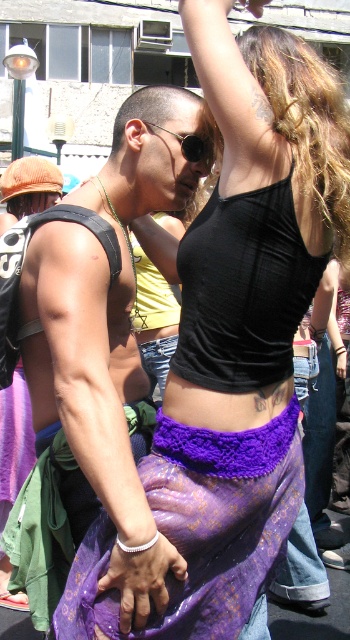
You are a photographer standing at the edge of the crowd. You want to take a photo of the purple crochet belt at center and the sunglasses at center so that both are in focus. The depth of field in your camera can cover objects within 8 meters. Will both objects be in focus?

The distance between the purple crochet belt at center and sunglasses at center is 8.26 meters. Since the depth of field can only cover 8 meters, the two objects are slightly out of the depth of field range. Therefore, both objects might not be in focus simultaneously.